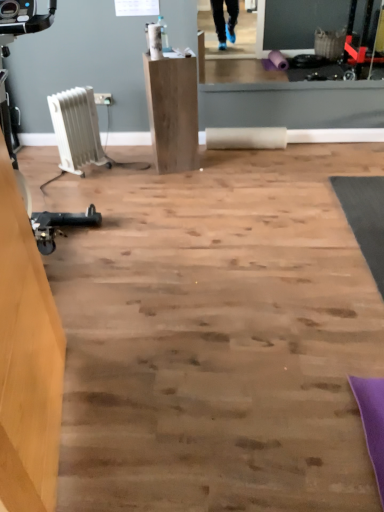
You are a GUI agent. You are given a task and a screenshot of the screen. Output one action in this format:
    pyautogui.click(x=<x>, y=<y>)
    Task: Click on the vacant space that is in between natural wood pedestal at center, arranged as the second furniture when viewed from the left, and wooden desk at left, arranged as the 2th furniture when viewed from the right
    Image resolution: width=384 pixels, height=512 pixels.
    Given the screenshot: What is the action you would take?
    pyautogui.click(x=143, y=262)